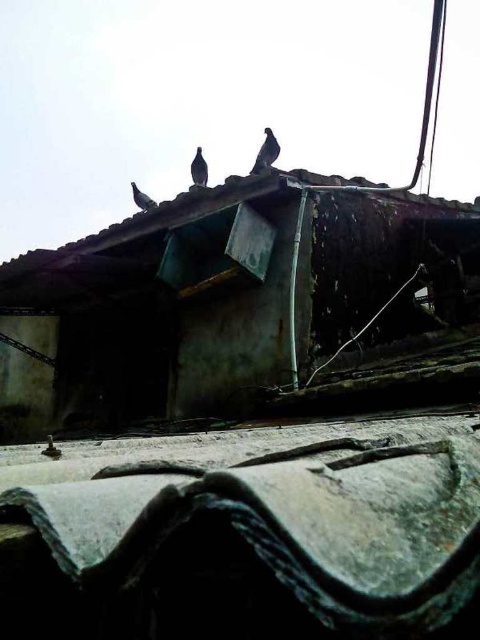
You are an architect analyzing the old building. You observe the gray textured tile roof at lower center and the silvery metallic bird at upper center. Which object is positioned to the right of the other?

The gray textured tile roof at lower center is to the right of the silvery metallic bird at upper center.

From the picture: You are an architect assessing the structural integrity of the gray textured tile roof at lower center and the rusty metal hut at upper center. Based on their heights, which one might require more immediate attention for potential collapse risks?

The gray textured tile roof at lower center has a lesser height compared to the rusty metal hut at upper center, which suggests it might be more unstable and thus require more immediate attention for potential collapse risks.

You are standing in front of the old building and notice two points marked on the ground. The first point is at coordinate point[252,616] and the second is at point[187,275]. Which point is closer to you?

Point[252,616] is in front of point[187,275], so it is closer to you.